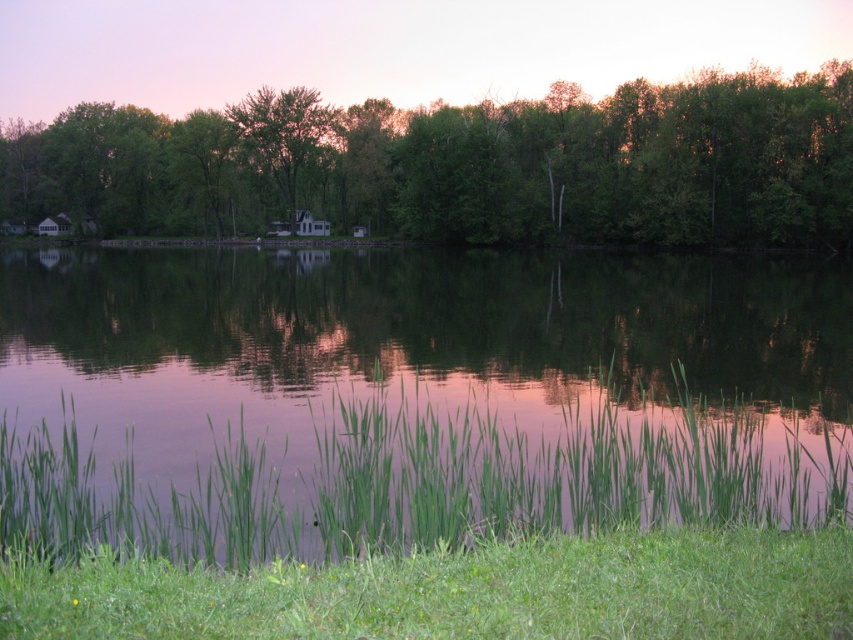
Question: Which object is positioned farthest from the green leafy trees at center?

Choices:
 (A) green matte tree at center
 (B) green grassy water at center

Answer: (B)

Question: Does green grassy water at center have a lesser width compared to green leafy trees at center?

Choices:
 (A) yes
 (B) no

Answer: (A)

Question: From the image, what is the correct spatial relationship of green grassy water at center in relation to green matte tree at center?

Choices:
 (A) above
 (B) below

Answer: (B)

Question: Estimate the real-world distances between objects in this image. Which object is farther from the green leafy trees at center?

Choices:
 (A) green grassy water at center
 (B) green matte tree at center

Answer: (A)

Question: Is green grassy water at center thinner than green matte tree at center?

Choices:
 (A) yes
 (B) no

Answer: (B)

Question: Which object is positioned farthest from the green grassy water at center?

Choices:
 (A) green leafy trees at center
 (B) green matte tree at center

Answer: (B)